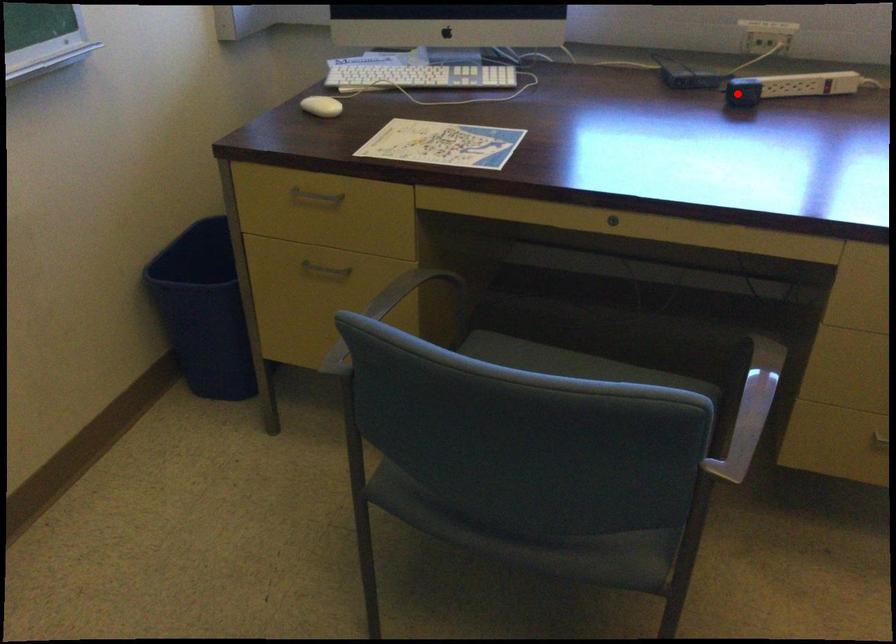
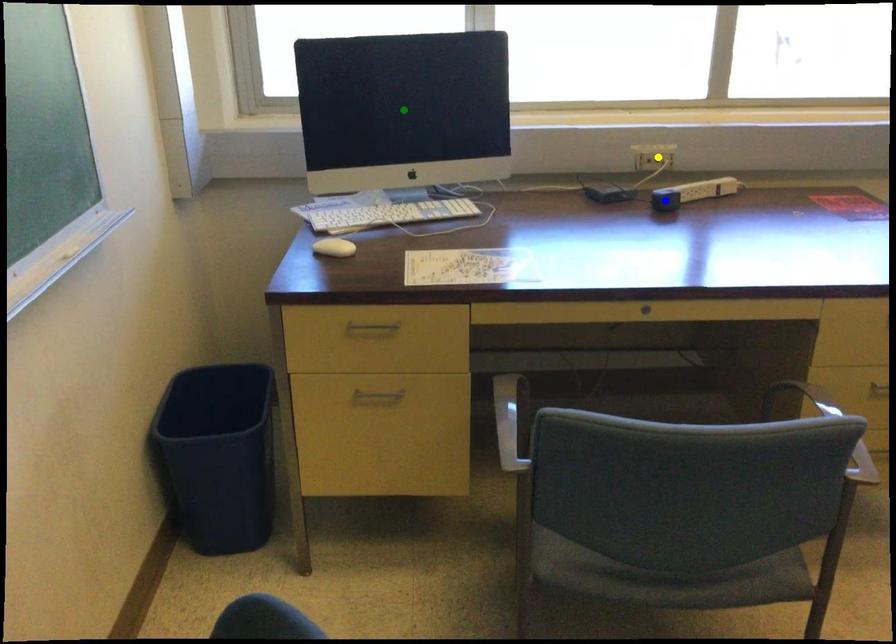
Question: I am providing you with two images of the same scene from different viewpoints. A red point is marked on the first image. You are given multiple points on the second image. In image 2, which mark is for the same physical point as the one in image 1?

Choices:
 (A) green point
 (B) yellow point
 (C) blue point

Answer: (C)